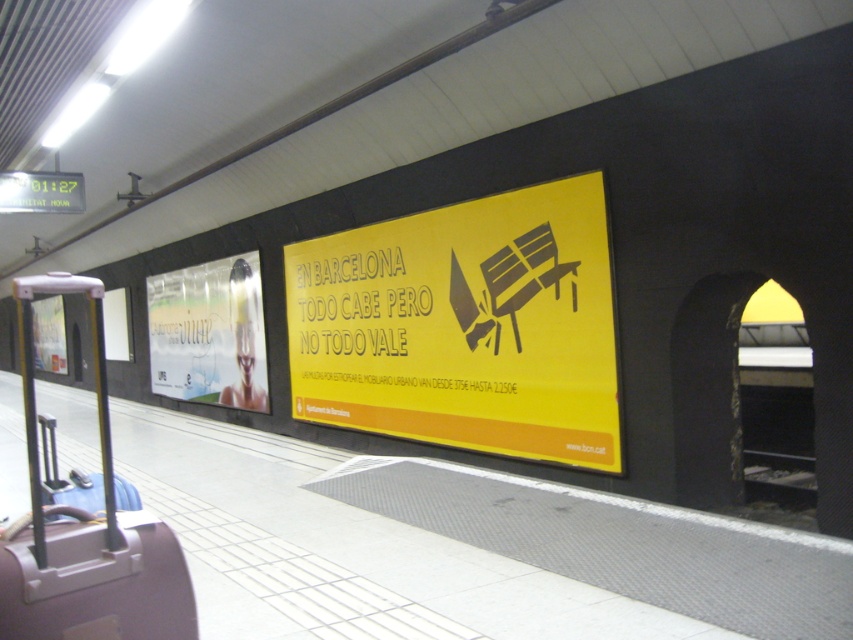
Who is shorter, yellow matte sign at center or blue fabric suitcase at lower left?

With less height is yellow matte sign at center.

Is yellow matte sign at center positioned in front of blue fabric suitcase at lower left?

No, yellow matte sign at center is further to the viewer.

Find the location of a particular element. The height and width of the screenshot is (640, 853). yellow matte sign at center is located at coordinates (364, 304).

Based on the photo, can you confirm if yellow paper sign at center is taller than purple matte suitcase at left?

No, yellow paper sign at center is not taller than purple matte suitcase at left.

Does yellow paper sign at center appear on the right side of purple matte suitcase at left?

Yes, yellow paper sign at center is to the right of purple matte suitcase at left.

Is point (448, 253) positioned in front of point (140, 538)?

No, (448, 253) is further to viewer.

Identify the location of yellow paper sign at center. (463, 326).

Who is lower down, purple matte suitcase at left or blue fabric suitcase at lower left?

Positioned lower is blue fabric suitcase at lower left.

What do you see at coordinates (86, 531) in the screenshot? The image size is (853, 640). I see `purple matte suitcase at left` at bounding box center [86, 531].

Locate an element on the screen. The height and width of the screenshot is (640, 853). purple matte suitcase at left is located at coordinates (86, 531).